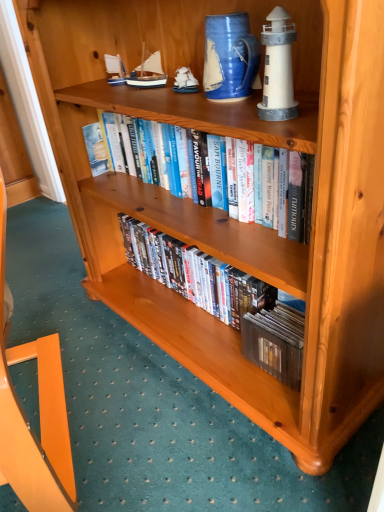
The width and height of the screenshot is (384, 512). Find the location of `vacant space situated on the left part of matte wooden dvds at center, which appears as the 2th book when viewed from the top`. vacant space situated on the left part of matte wooden dvds at center, which appears as the 2th book when viewed from the top is located at coordinates (87, 356).